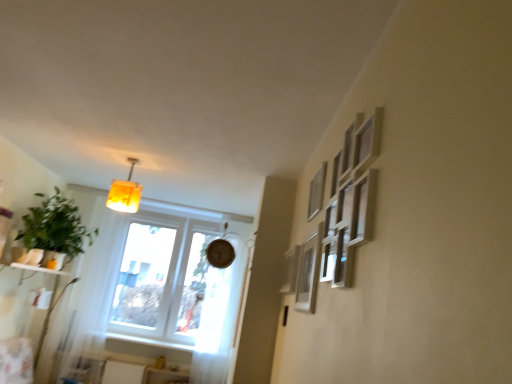
Question: From a real-world perspective, relative to white painted wood at lower left, is matte silver picture frame at upper right, which ranks as the 1th picture frame in back-to-front order, vertically above or below?

Choices:
 (A) above
 (B) below

Answer: (A)

Question: Is matte silver picture frame at upper right, the third picture frame when ordered from front to back, taller or shorter than white painted wood at lower left?

Choices:
 (A) tall
 (B) short

Answer: (A)

Question: Which is farther from the white painted wood at lower left?

Choices:
 (A) white sheer curtain at center
 (B) green matte plant at left
 (C) matte silver picture frame at upper right, which is the 2th picture frame in front-to-back order
 (D) matte silver picture frame at right, arranged as the 3th picture frame when viewed from the back
 (E) matte yellow plastic lamp at upper left

Answer: (C)

Question: Estimate the real-world distances between objects in this image. Which object is farther from the matte silver picture frame at right, positioned as the 1th picture frame in front-to-back order?

Choices:
 (A) green matte plant at left
 (B) white painted wood at lower left
 (C) white sheer curtain at center
 (D) matte silver picture frame at upper right, which is the 2th picture frame in front-to-back order
 (E) matte yellow plastic lamp at upper left

Answer: (B)